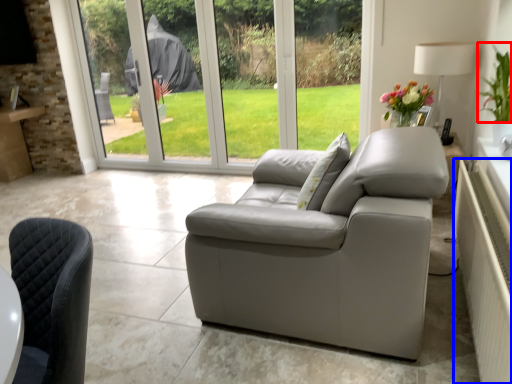
Question: Which object is closer to the camera taking this photo, plant (highlighted by a red box) or radiator (highlighted by a blue box)?

Choices:
 (A) plant
 (B) radiator

Answer: (B)